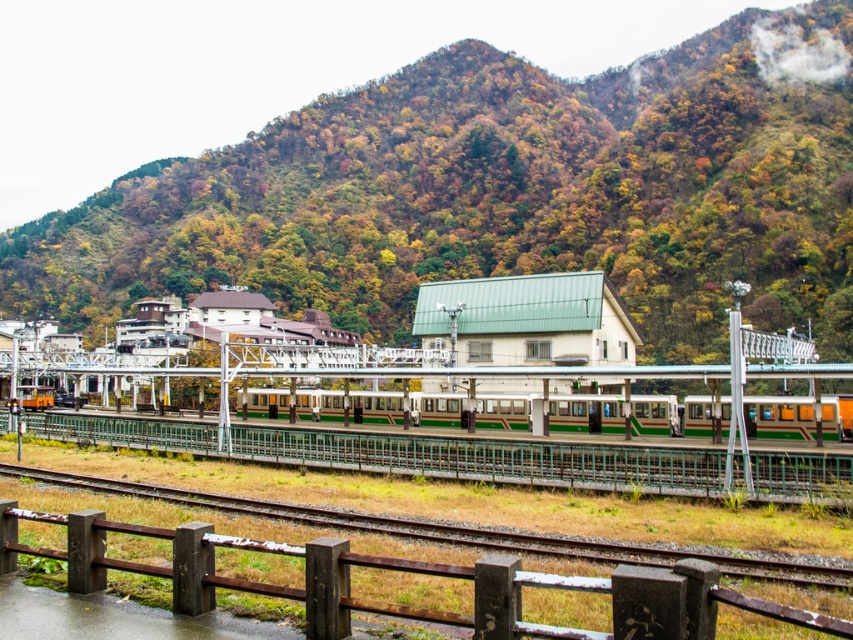
Does brown wooden fence at lower center appear under green metallic train at center?

Incorrect, brown wooden fence at lower center is not positioned below green metallic train at center.

Which is in front, point (489, 609) or point (39, 392)?

Point (489, 609)

The width and height of the screenshot is (853, 640). In order to click on brown wooden fence at lower center in this screenshot , I will do `click(405, 572)`.

Does green leafy hillside at upper center appear on the right side of green matte train at center?

No, green leafy hillside at upper center is not to the right of green matte train at center.

Is point (646, 324) behind point (708, 426)?

Yes, it is.

I want to click on green leafy hillside at upper center, so click(x=502, y=193).

Between green metal fence at lower center and green metallic train at center, which one is positioned higher?

green metal fence at lower center

Looking at this image, does green metal fence at lower center come in front of green metallic train at center?

Yes, it is in front of green metallic train at center.

Does point (137, 436) come in front of point (45, 392)?

Yes, it is in front of point (45, 392).

I want to click on green metal fence at lower center, so click(x=488, y=458).